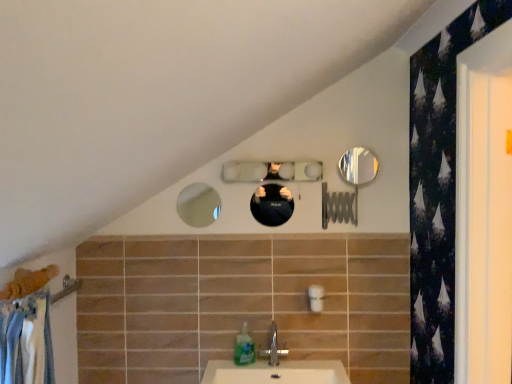
Image resolution: width=512 pixels, height=384 pixels. Describe the element at coordinates (272, 205) in the screenshot. I see `shiny black mirror at center, the second mirror from the left` at that location.

This screenshot has width=512, height=384. In order to click on clear glass mirror at center, arranged as the third mirror when viewed from the left in this screenshot , I will do `click(271, 171)`.

How far apart are silver metallic tap at center and shiny metallic mirror at upper right, placed as the first mirror when sorted from right to left?

The distance of silver metallic tap at center from shiny metallic mirror at upper right, placed as the first mirror when sorted from right to left, is 31.71 inches.

Between silver metallic tap at center and shiny metallic mirror at upper right, placed as the first mirror when sorted from right to left, which one has larger size?

silver metallic tap at center.

Considering the relative positions of silver metallic tap at center and shiny metallic mirror at upper right, placed as the first mirror when sorted from right to left, in the image provided, is silver metallic tap at center to the left or to the right of shiny metallic mirror at upper right, placed as the first mirror when sorted from right to left,?

silver metallic tap at center is positioned on shiny metallic mirror at upper right, placed as the first mirror when sorted from right to left,'s left side.

Is silver metallic tap at center closer to the viewer compared to shiny metallic mirror at upper right, placed as the first mirror when sorted from right to left?

Yes, it is in front of shiny metallic mirror at upper right, placed as the first mirror when sorted from right to left.

Is white ceramic sink at lower center facing towards shiny metallic mirror at upper right, which is the fourth mirror from left to right?

No, white ceramic sink at lower center is not facing towards shiny metallic mirror at upper right, which is the fourth mirror from left to right.

From the picture: Is white ceramic sink at lower center positioned far away from shiny metallic mirror at upper right, placed as the first mirror when sorted from right to left?

No, white ceramic sink at lower center is not far from shiny metallic mirror at upper right, placed as the first mirror when sorted from right to left.

Locate an element on the screen. Image resolution: width=512 pixels, height=384 pixels. mirror that is the 4th one above the white ceramic sink at lower center (from a real-world perspective) is located at coordinates (358, 166).

Is white ceramic sink at lower center taller than shiny metallic mirror at upper right, placed as the first mirror when sorted from right to left?

In fact, white ceramic sink at lower center may be shorter than shiny metallic mirror at upper right, placed as the first mirror when sorted from right to left.

Is silver metallic tap at center inside or outside of white ceramic sink at lower center?

The correct answer is: outside.

How many degrees apart are the facing directions of silver metallic tap at center and white ceramic sink at lower center?

1.6 degrees.

Is silver metallic tap at center oriented away from white ceramic sink at lower center?

No, silver metallic tap at center is not facing the opposite direction of white ceramic sink at lower center.

Which point is more distant from viewer, [271,344] or [335,366]?

Positioned behind is point [271,344].

Considering the relative positions of white ceramic sink at lower center and silver metallic tap at center in the image provided, is white ceramic sink at lower center behind silver metallic tap at center?

No, it is not.

Where is `tap that is above the white ceramic sink at lower center (from a real-world perspective)`? tap that is above the white ceramic sink at lower center (from a real-world perspective) is located at coordinates (273, 348).

Can you confirm if white ceramic sink at lower center is bigger than silver metallic tap at center?

Indeed, white ceramic sink at lower center has a larger size compared to silver metallic tap at center.

Between white ceramic sink at lower center and silver metallic tap at center, which one has less height?

With less height is white ceramic sink at lower center.

Which is more to the right, shiny metallic mirror at upper right, placed as the first mirror when sorted from right to left, or silver metallic tap at center?

shiny metallic mirror at upper right, placed as the first mirror when sorted from right to left.

Which object is further away from the camera, shiny metallic mirror at upper right, placed as the first mirror when sorted from right to left, or silver metallic tap at center?

shiny metallic mirror at upper right, placed as the first mirror when sorted from right to left, is behind.

Considering the sizes of objects shiny metallic mirror at upper right, which is the fourth mirror from left to right, and silver metallic tap at center in the image provided, who is shorter, shiny metallic mirror at upper right, which is the fourth mirror from left to right, or silver metallic tap at center?

Standing shorter between the two is shiny metallic mirror at upper right, which is the fourth mirror from left to right.

From a real-world perspective, relative to silver metallic tap at center, is shiny metallic mirror at upper right, placed as the first mirror when sorted from right to left, vertically above or below?

In terms of real-world spatial position, shiny metallic mirror at upper right, placed as the first mirror when sorted from right to left, is above silver metallic tap at center.

From the image's perspective, is shiny metallic mirror at upper right, which is the fourth mirror from left to right, on shiny black mirror at center, arranged as the 3th mirror when viewed from the right?

Yes.

Which object is positioned more to the right, shiny metallic mirror at upper right, which is the fourth mirror from left to right, or shiny black mirror at center, arranged as the 3th mirror when viewed from the right?

Positioned to the right is shiny metallic mirror at upper right, which is the fourth mirror from left to right.

Is shiny black mirror at center, the second mirror from the left, located within shiny metallic mirror at upper right, placed as the first mirror when sorted from right to left?

Definitely not — shiny black mirror at center, the second mirror from the left, is not inside shiny metallic mirror at upper right, placed as the first mirror when sorted from right to left.

Is shiny metallic mirror at upper right, which is the fourth mirror from left to right, touching shiny black mirror at center, the second mirror from the left?

No, shiny metallic mirror at upper right, which is the fourth mirror from left to right, is not with shiny black mirror at center, the second mirror from the left.

Is silver metallic tap at center in front of or behind matte glass mirror at upper center, the fourth mirror positioned from the right, in the image?

silver metallic tap at center is in front of matte glass mirror at upper center, the fourth mirror positioned from the right.

Between silver metallic tap at center and matte glass mirror at upper center, acting as the first mirror starting from the left, which one has smaller width?

Thinner between the two is matte glass mirror at upper center, acting as the first mirror starting from the left.

Does point (272, 347) lie behind point (198, 190)?

No, it is not.

Where is `tap located below the shiny metallic mirror at upper right, which is the fourth mirror from left to right (from the image's perspective)`? Image resolution: width=512 pixels, height=384 pixels. tap located below the shiny metallic mirror at upper right, which is the fourth mirror from left to right (from the image's perspective) is located at coordinates (273, 348).

Where is `counter top beneath the shiny metallic mirror at upper right, which is the fourth mirror from left to right (from a real-world perspective)`? This screenshot has height=384, width=512. counter top beneath the shiny metallic mirror at upper right, which is the fourth mirror from left to right (from a real-world perspective) is located at coordinates (276, 372).

Looking at this image, estimate the real-world distances between objects in this image. Which object is closer to silver metallic tap at center, translucent plastic soap dispenser at lower center or clear glass mirror at center, arranged as the third mirror when viewed from the left?

translucent plastic soap dispenser at lower center.

When comparing their distances from clear glass mirror at center, arranged as the third mirror when viewed from the left, does silver metallic tap at center or matte glass mirror at upper center, acting as the first mirror starting from the left, seem closer?

silver metallic tap at center is closer to clear glass mirror at center, arranged as the third mirror when viewed from the left.

Which object lies further to the anchor point matte glass mirror at upper center, the fourth mirror positioned from the right, shiny metallic mirror at upper right, placed as the first mirror when sorted from right to left, or clear glass mirror at center, placed as the second mirror when sorted from right to left?

shiny metallic mirror at upper right, placed as the first mirror when sorted from right to left, is positioned further to the anchor matte glass mirror at upper center, the fourth mirror positioned from the right.

Considering their positions, is clear glass mirror at center, placed as the second mirror when sorted from right to left, positioned closer to white ceramic sink at lower center than silver metallic tap at center?

Based on the image, silver metallic tap at center appears to be nearer to white ceramic sink at lower center.

Considering their positions, is matte glass mirror at upper center, the fourth mirror positioned from the right, positioned further to shiny metallic mirror at upper right, which is the fourth mirror from left to right, than silver metallic tap at center?

matte glass mirror at upper center, the fourth mirror positioned from the right.

Considering their positions, is shiny metallic mirror at upper right, placed as the first mirror when sorted from right to left, positioned closer to white ceramic sink at lower center than translucent plastic soap dispenser at lower center?

translucent plastic soap dispenser at lower center is positioned closer to the anchor white ceramic sink at lower center.

When comparing their distances from translucent plastic soap dispenser at lower center, does shiny black mirror at center, the second mirror from the left, or shiny metallic mirror at upper right, which is the fourth mirror from left to right, seem closer?

shiny black mirror at center, the second mirror from the left, lies closer to translucent plastic soap dispenser at lower center than the other object.

From the image, which object appears to be nearer to matte glass mirror at upper center, acting as the first mirror starting from the left, translucent plastic soap dispenser at lower center or shiny black mirror at center, the second mirror from the left?

shiny black mirror at center, the second mirror from the left, is positioned closer to the anchor matte glass mirror at upper center, acting as the first mirror starting from the left.

The image size is (512, 384). I want to click on tap between shiny black mirror at center, the second mirror from the left, and translucent plastic soap dispenser at lower center from top to bottom, so click(x=273, y=348).

Locate an element on the screen. The image size is (512, 384). mirror between matte glass mirror at upper center, the fourth mirror positioned from the right, and white ceramic sink at lower center in the up-down direction is located at coordinates (272, 205).

Find the location of `mirror between matte glass mirror at upper center, the fourth mirror positioned from the right, and translucent plastic soap dispenser at lower center from top to bottom`. mirror between matte glass mirror at upper center, the fourth mirror positioned from the right, and translucent plastic soap dispenser at lower center from top to bottom is located at coordinates (272, 205).

Where is `tap between clear glass mirror at center, placed as the second mirror when sorted from right to left, and translucent plastic soap dispenser at lower center vertically`? The width and height of the screenshot is (512, 384). tap between clear glass mirror at center, placed as the second mirror when sorted from right to left, and translucent plastic soap dispenser at lower center vertically is located at coordinates (273, 348).